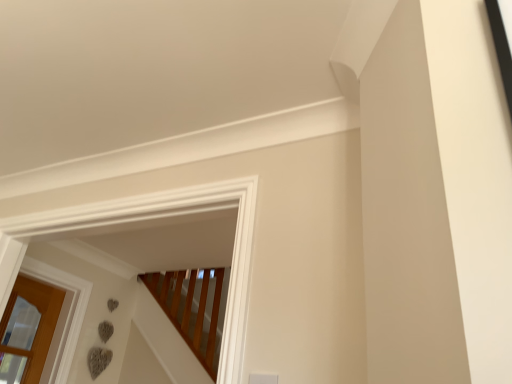
The height and width of the screenshot is (384, 512). Find the location of `empty space that is ontop of wooden door at left (from a real-world perspective)`. empty space that is ontop of wooden door at left (from a real-world perspective) is located at coordinates (54, 270).